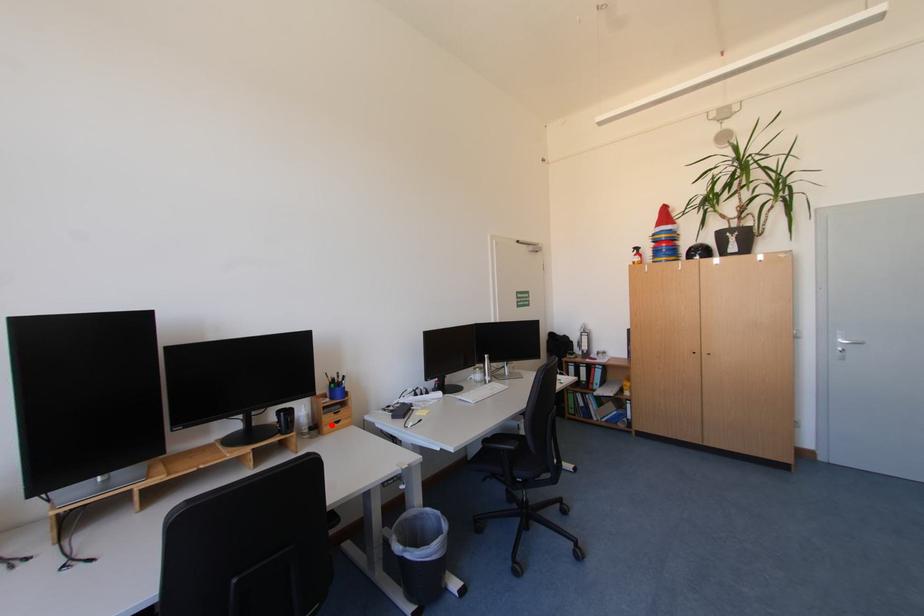
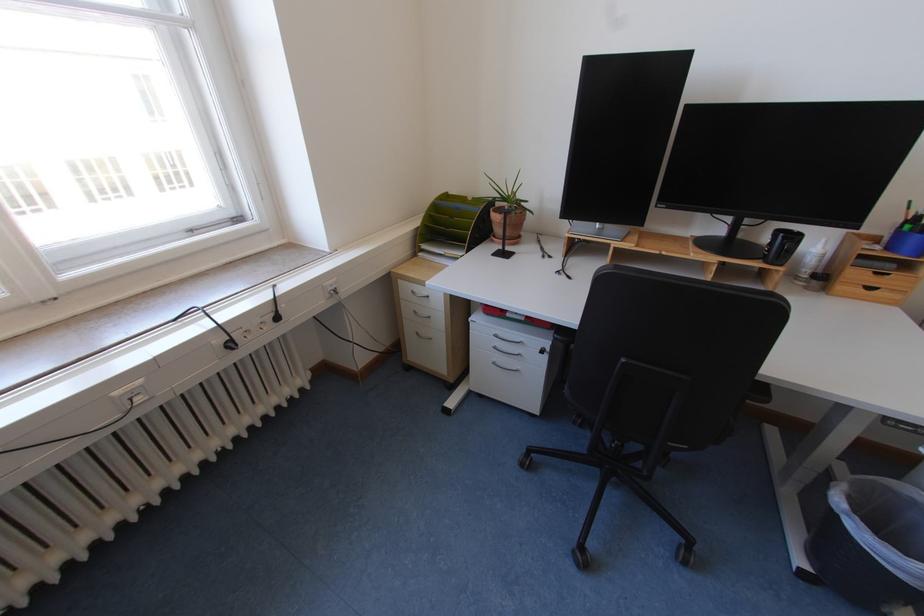
Where in the second image is the point corresponding to the highlighted location from the first image?

(848, 281)